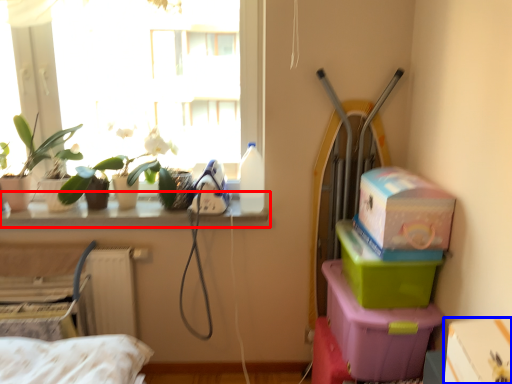
Question: Which object is closer to the camera taking this photo, window sill (highlighted by a red box) or box (highlighted by a blue box)?

Choices:
 (A) window sill
 (B) box

Answer: (B)